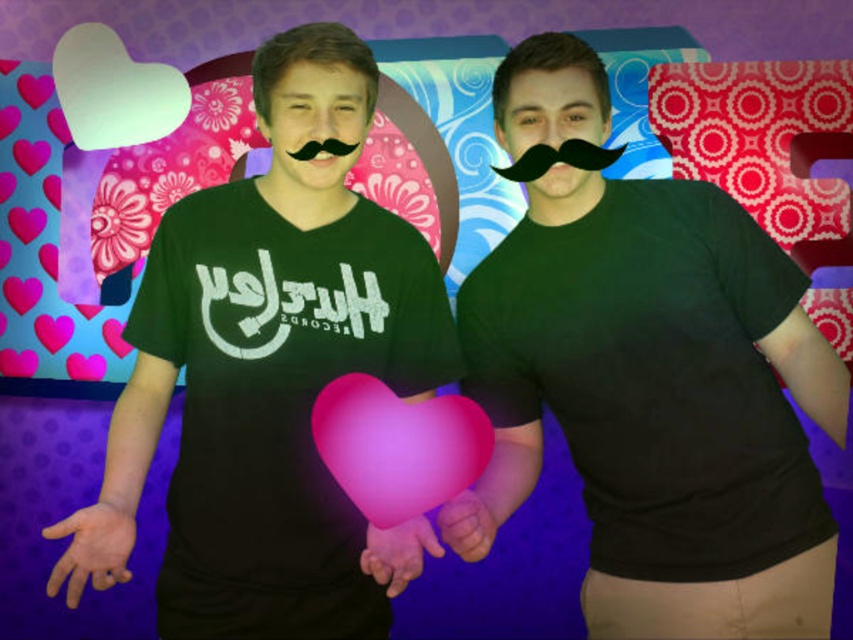
Can you confirm if pink rubber heart at center is positioned to the left of black fuzzy mustache at center?

In fact, pink rubber heart at center is to the right of black fuzzy mustache at center.

Between pink rubber heart at center and black fuzzy mustache at center, which one has more height?

pink rubber heart at center

Is point (378, 513) farther from camera compared to point (325, 140)?

No, it is in front of (325, 140).

You are a GUI agent. You are given a task and a screenshot of the screen. Output one action in this format:
    pyautogui.click(x=<x>, y=<y>)
    Task: Click on the pink rubber heart at center
    Image resolution: width=853 pixels, height=640 pixels.
    Given the screenshot: What is the action you would take?
    pyautogui.click(x=398, y=445)

Measure the distance between point (222, 440) and camera.

The distance of point (222, 440) from camera is 4.18 feet.

Looking at this image, is green matte t-shirt at center above black fuzzy mustache at center?

Incorrect, green matte t-shirt at center is not positioned above black fuzzy mustache at center.

Which is in front, point (364, 61) or point (303, 145)?

Point (303, 145) is in front.

Where is `green matte t-shirt at center`? The image size is (853, 640). green matte t-shirt at center is located at coordinates (270, 376).

Consider the image. Can you confirm if green matte t-shirt at center is shorter than pink rubber heart at center?

No.

Does point (297, 44) lie in front of point (402, 502)?

No.

The height and width of the screenshot is (640, 853). Identify the location of green matte t-shirt at center. click(x=270, y=376).

Find the location of a particular element. Image resolution: width=853 pixels, height=640 pixels. green matte t-shirt at center is located at coordinates (270, 376).